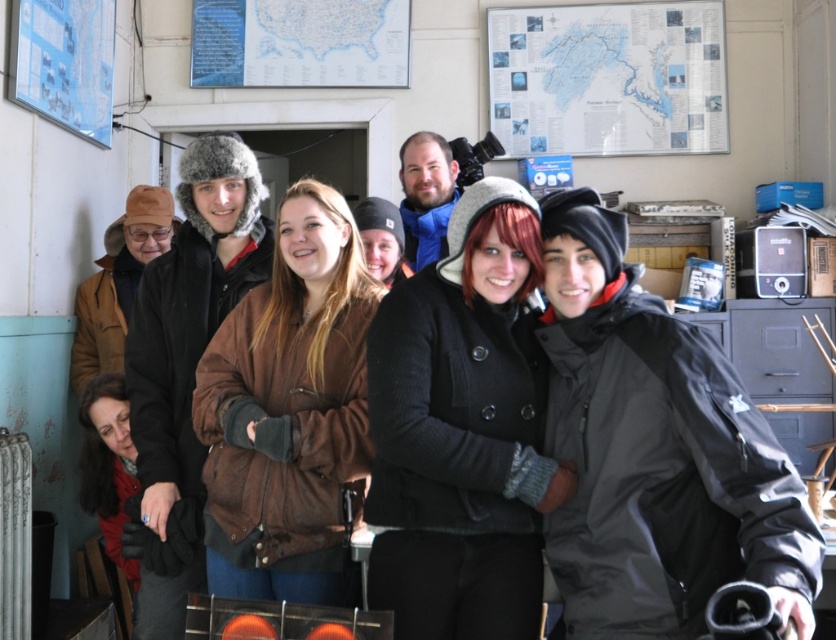
Which is more to the right, brown suede jacket at center or white paper map at upper right?

white paper map at upper right

Is brown suede jacket at center further to camera compared to white paper map at upper right?

No, it is in front of white paper map at upper right.

Between point (268, 509) and point (617, 92), which one is positioned in front?

Point (268, 509) is more forward.

In order to click on brown suede jacket at center in this screenshot , I will do `click(288, 410)`.

Does point (636, 529) lie behind point (296, 520)?

That is False.

Does black matte jacket at center appear over brown suede jacket at center?

No.

This screenshot has width=836, height=640. Describe the element at coordinates (655, 451) in the screenshot. I see `black matte jacket at center` at that location.

Locate an element on the screen. The width and height of the screenshot is (836, 640). black matte jacket at center is located at coordinates (655, 451).

Is black matte jacket at center shorter than black wool coat at center?

Indeed, black matte jacket at center has a lesser height compared to black wool coat at center.

Does black matte jacket at center lie in front of black wool coat at center?

That is True.

The width and height of the screenshot is (836, 640). What are the coordinates of `black matte jacket at center` in the screenshot? It's located at 655,451.

The height and width of the screenshot is (640, 836). In order to click on black matte jacket at center in this screenshot , I will do `click(655, 451)`.